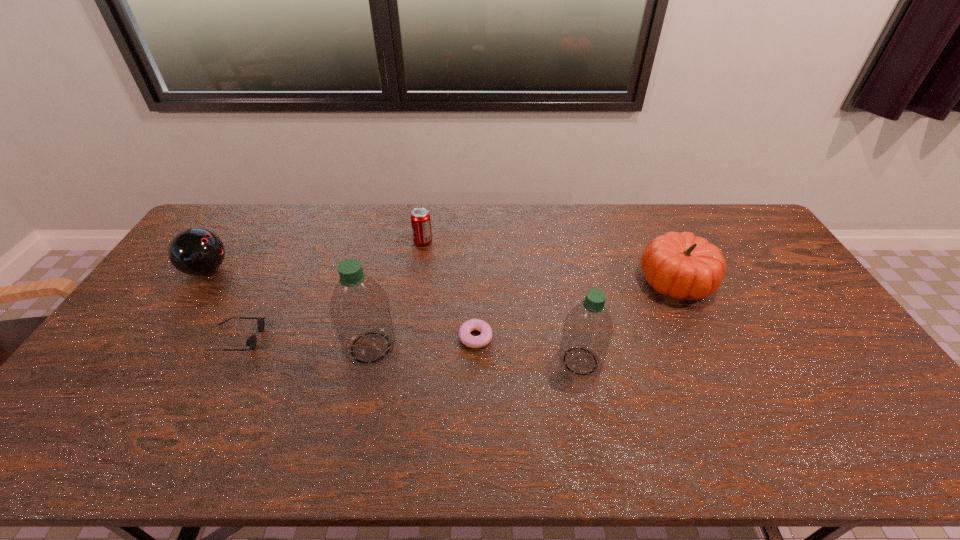
Please point a vacant point for placing a water bottle on the right. Please provide its 2D coordinates. Your answer should be formatted as a tuple, i.e. [(x, y)], where the tuple contains the x and y coordinates of a point satisfying the conditions above.

[(802, 376)]